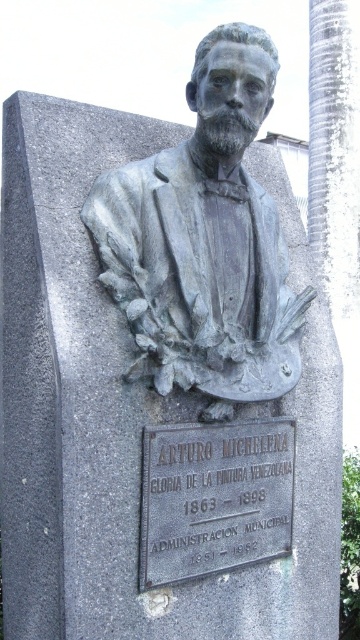
Question: Does bronze bust at center appear over black metal plaque at center?

Choices:
 (A) no
 (B) yes

Answer: (B)

Question: In this image, where is bronze bust at center located relative to black metal plaque at center?

Choices:
 (A) above
 (B) below

Answer: (A)

Question: Observing the image, what is the correct spatial positioning of bronze bust at center in reference to black metal plaque at center?

Choices:
 (A) above
 (B) below

Answer: (A)

Question: Which point is closer to the camera?

Choices:
 (A) (163, 513)
 (B) (172, 316)

Answer: (A)